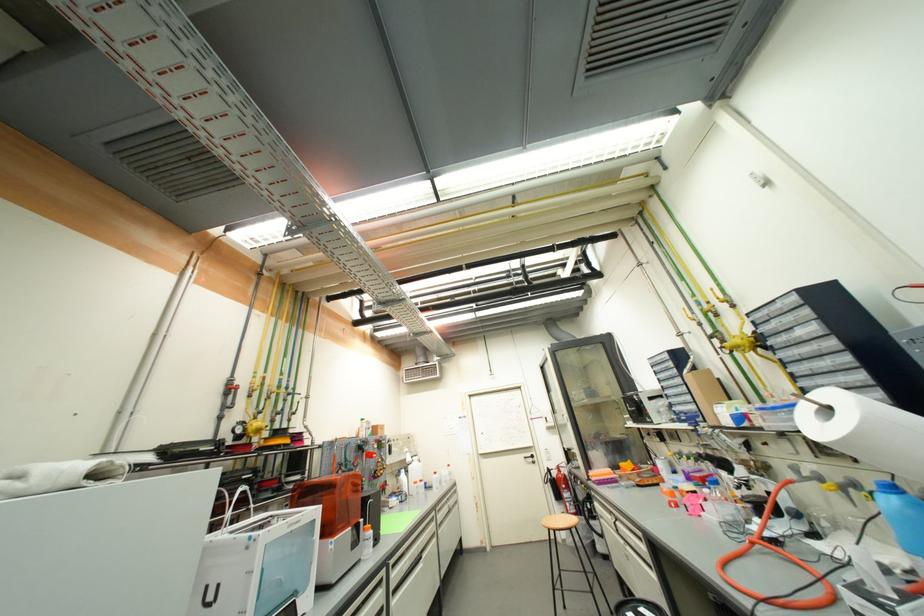
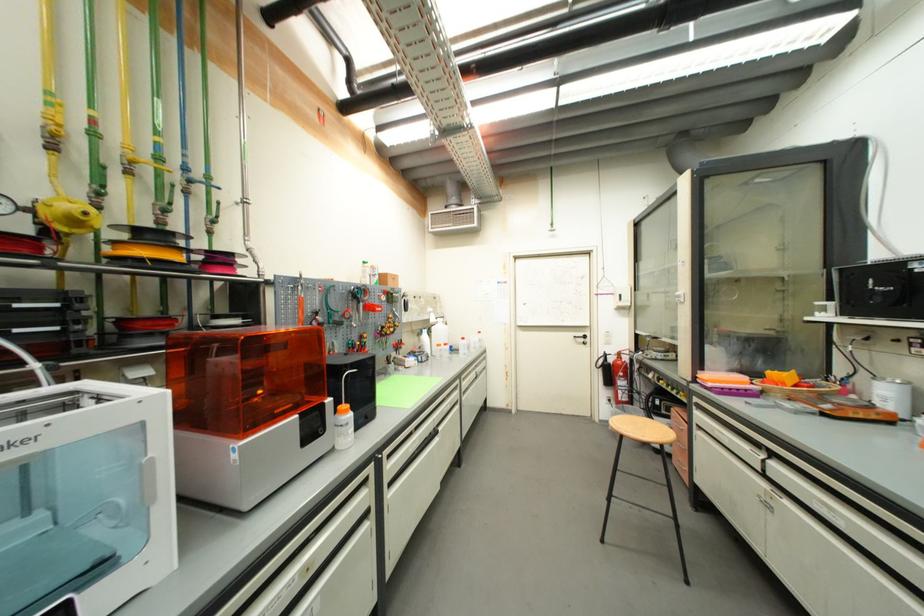
Question: I am providing you with two images of the same scene from different viewpoints. After the viewpoint changes to image2, which objects are now occluded?

Choices:
 (A) black filament spool
 (B) appliance control dial
 (C) wicker basket
 (D) none of these

Answer: (D)